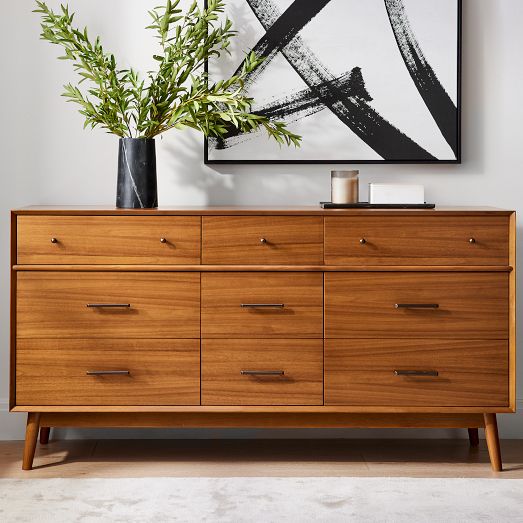
Image resolution: width=523 pixels, height=523 pixels. I want to click on area where ash tray could be placed, so click(x=230, y=208).